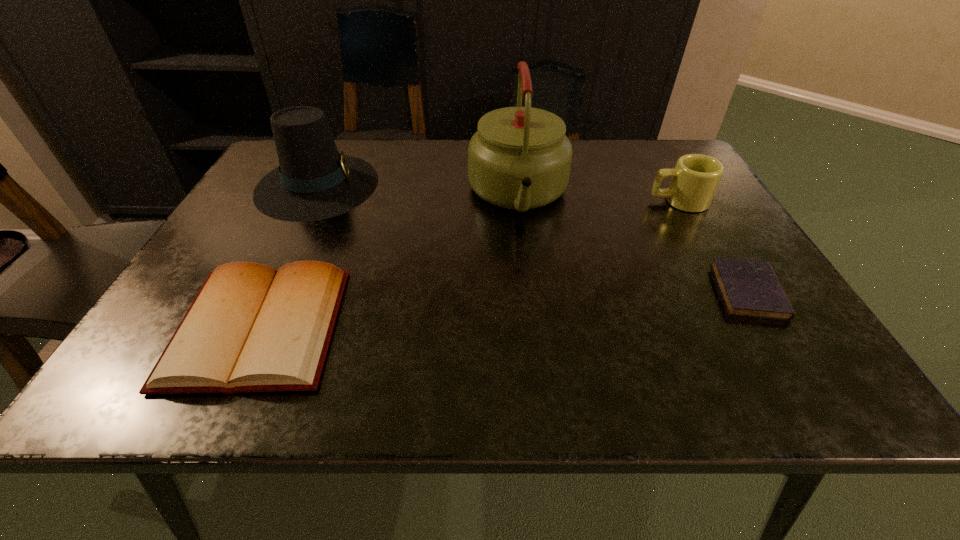
This screenshot has width=960, height=540. Find the location of `blank region between the kettle and the shortest object`. blank region between the kettle and the shortest object is located at coordinates (634, 243).

Locate an element on the screen. Image resolution: width=960 pixels, height=540 pixels. free space between the hat and the third object from right to left is located at coordinates (418, 190).

The image size is (960, 540). I want to click on free space between the third object from right to left and the hat, so click(x=418, y=190).

This screenshot has height=540, width=960. I want to click on free space between the mug and the kettle, so click(598, 198).

Find the location of a particular element. free space between the Bible and the diary is located at coordinates (504, 309).

Where is `empty location between the third object from left to right and the third tallest object`? The width and height of the screenshot is (960, 540). empty location between the third object from left to right and the third tallest object is located at coordinates (598, 198).

Identify the location of unoccupied position between the diary and the Bible. This screenshot has width=960, height=540. (504, 309).

Identify the location of object that is the third closest to the Bible. This screenshot has height=540, width=960. (695, 178).

Select which object appears as the third closest to the Bible. Please provide its 2D coordinates. Your answer should be formatted as a tuple, i.e. [(x, y)], where the tuple contains the x and y coordinates of a point satisfying the conditions above.

[(695, 178)]

Find the location of `vacant space that satisfies the following two spatial constraints: 1. with the handle on the side of the mug; 2. on the right side of the diary`. vacant space that satisfies the following two spatial constraints: 1. with the handle on the side of the mug; 2. on the right side of the diary is located at coordinates (730, 292).